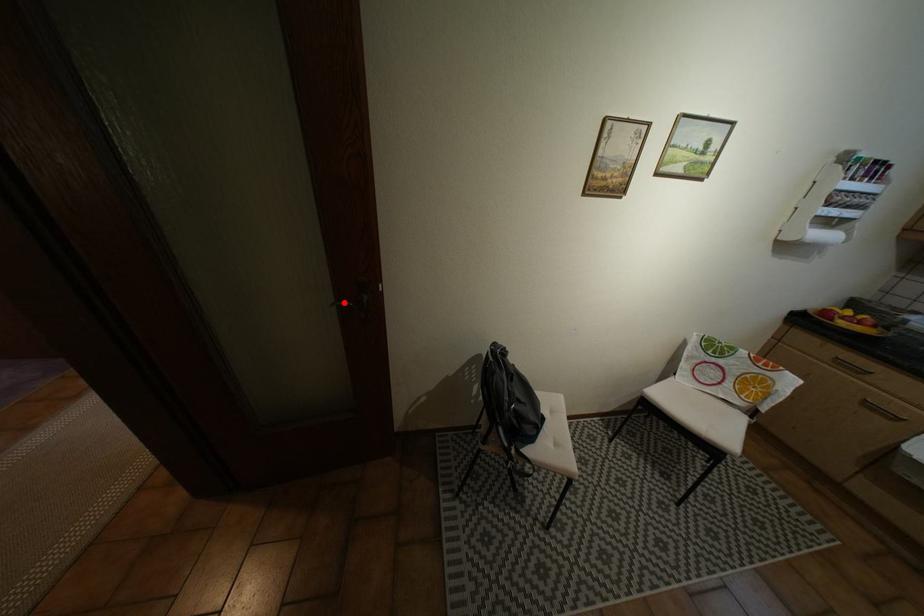
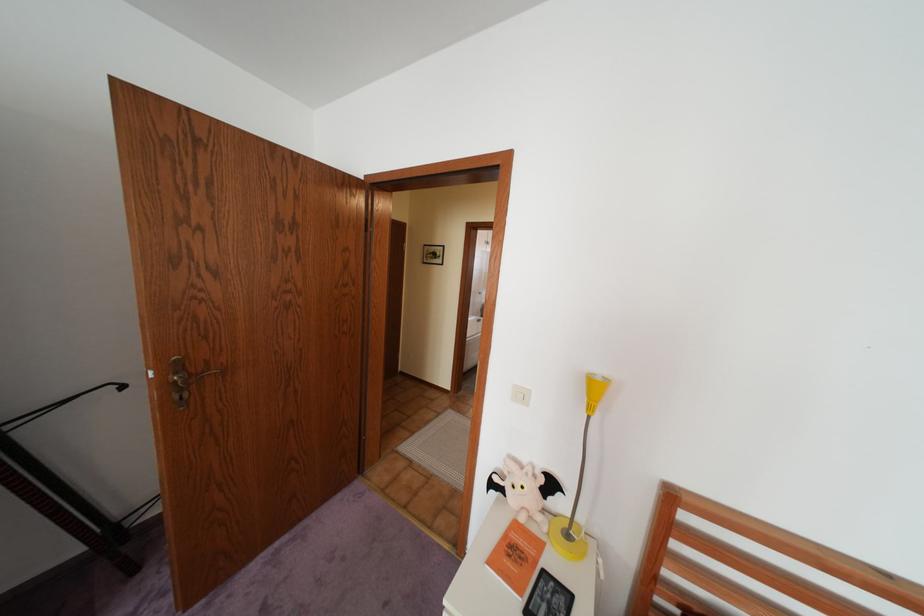
Question: I am providing you with two images of the same scene from different viewpoints. A red point is marked on the first image. Can you still see the location of the red point in image 2?

Choices:
 (A) Yes
 (B) No

Answer: (B)